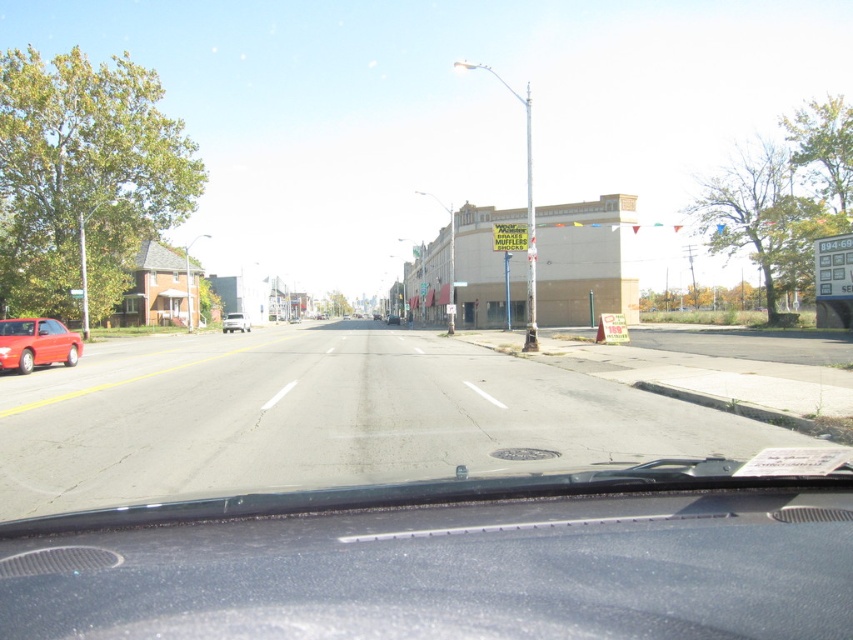
You are sitting in the driver seat of the vehicle and see two points marked on the road ahead. The first point is at location point (6, 358) and the second point is at point (395, 323). Which point is closer to your current position?

Point (6, 358) is closer to the viewer than point (395, 323), so the first point is closer to your current position.

You are driving a car and see the matte red car at left and the metallic silver sedan at center. Which one is closer to you?

Both the matte red car at left and metallic silver sedan at center are 72.57 meters apart from each other, but the question asks which is closer to you. Since the matte red car is at the left and the metallic silver sedan is at the center, their distance from the observer depends on their positions along the road. However, the provided description only states their separation from each other, not their individual distances from the viewer. Without additional information about their positions relative to the

You are driving a car and need to check the position of the black glossy dashboard at center relative to the point marked at coordinates (448, 561). Is the dashboard exactly at that point?

Yes, the black glossy dashboard at center is located exactly at point (448, 561).